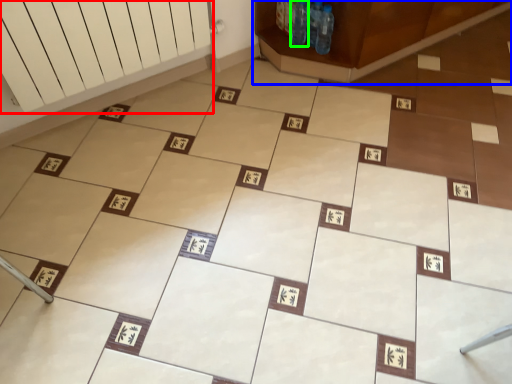
Question: Which is nearer to the radiator (highlighted by a red box)? furniture (highlighted by a blue box) or bottle (highlighted by a green box).

Choices:
 (A) furniture
 (B) bottle

Answer: (A)